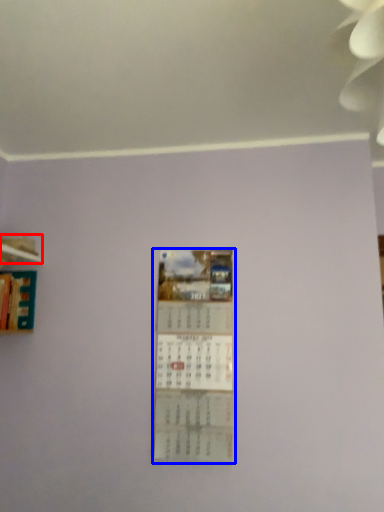
Question: Which object appears closest to the camera in this image, shelf (highlighted by a red box) or poster (highlighted by a blue box)?

Choices:
 (A) shelf
 (B) poster

Answer: (B)